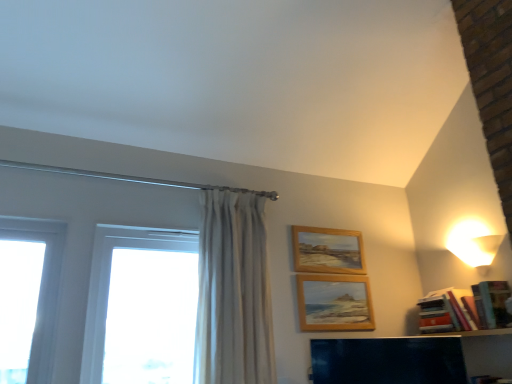
What is the approximate height of wooden picture frame at center, which ranks as the 1th picture frame in bottom-to-top order?

wooden picture frame at center, which ranks as the 1th picture frame in bottom-to-top order, is 12.62 inches tall.

What do you see at coordinates (327, 250) in the screenshot?
I see `wooden picture frame at upper center, the 2th picture frame in the bottom-to-top sequence` at bounding box center [327, 250].

I want to click on wooden shelf at lower right, so click(412, 358).

Find the location of a particular element. The image size is (512, 384). white glossy lampshade at upper right is located at coordinates (474, 244).

Where is `wooden picture frame at center, which ranks as the 1th picture frame in bottom-to-top order`? The height and width of the screenshot is (384, 512). wooden picture frame at center, which ranks as the 1th picture frame in bottom-to-top order is located at coordinates (334, 303).

From the picture: From a real-world perspective, does wooden picture frame at center, which appears as the 2th picture frame when viewed from the top, stand above wooden picture frame at upper center, the 1th picture frame from the top?

No, from a real-world perspective, wooden picture frame at center, which appears as the 2th picture frame when viewed from the top, is not above wooden picture frame at upper center, the 1th picture frame from the top.

From the image's perspective, is wooden picture frame at center, which ranks as the 1th picture frame in bottom-to-top order, located above or below wooden picture frame at upper center, the 2th picture frame in the bottom-to-top sequence?

Based on their image positions, wooden picture frame at center, which ranks as the 1th picture frame in bottom-to-top order, is located beneath wooden picture frame at upper center, the 2th picture frame in the bottom-to-top sequence.

Is wooden picture frame at center, which appears as the 2th picture frame when viewed from the top, bigger or smaller than wooden picture frame at upper center, the 2th picture frame in the bottom-to-top sequence?

Considering their sizes, wooden picture frame at center, which appears as the 2th picture frame when viewed from the top, takes up less space than wooden picture frame at upper center, the 2th picture frame in the bottom-to-top sequence.

Are hardcover books at right and white glossy lampshade at upper right making contact?

hardcover books at right is not next to white glossy lampshade at upper right, and they're not touching.

Could white glossy lampshade at upper right be considered to be inside hardcover books at right?

Actually, white glossy lampshade at upper right is outside hardcover books at right.

Considering the relative positions of hardcover books at right and white glossy lampshade at upper right in the image provided, is hardcover books at right in front of white glossy lampshade at upper right?

That is True.

Which object is wider, hardcover books at right or white glossy lampshade at upper right?

With larger width is hardcover books at right.

Can you tell me how much white glossy lampshade at upper right and wooden shelf at lower right differ in facing direction?

white glossy lampshade at upper right and wooden shelf at lower right are facing 48.1 degrees away from each other.

Is white glossy lampshade at upper right not close to wooden shelf at lower right?

No, white glossy lampshade at upper right is not far away from wooden shelf at lower right.

Is white glossy lampshade at upper right spatially inside wooden shelf at lower right, or outside of it?

white glossy lampshade at upper right cannot be found inside wooden shelf at lower right.

Is there a large distance between hardcover books at right and wooden picture frame at upper center, the 1th picture frame from the top?

That's not correct — hardcover books at right is a little close to wooden picture frame at upper center, the 1th picture frame from the top.

Does hardcover books at right appear on the right side of wooden picture frame at upper center, the 1th picture frame from the top?

Yes.

Which is correct: hardcover books at right is inside wooden picture frame at upper center, the 2th picture frame in the bottom-to-top sequence, or outside of it?

hardcover books at right is located beyond the bounds of wooden picture frame at upper center, the 2th picture frame in the bottom-to-top sequence.

Considering the positions of objects wooden shelf at lower right and wooden picture frame at upper center, the 2th picture frame in the bottom-to-top sequence, in the image provided, who is behind, wooden shelf at lower right or wooden picture frame at upper center, the 2th picture frame in the bottom-to-top sequence,?

Positioned behind is wooden picture frame at upper center, the 2th picture frame in the bottom-to-top sequence.

Considering the sizes of objects wooden shelf at lower right and wooden picture frame at upper center, the 1th picture frame from the top, in the image provided, who is shorter, wooden shelf at lower right or wooden picture frame at upper center, the 1th picture frame from the top,?

wooden picture frame at upper center, the 1th picture frame from the top.

Can you tell me how much wooden shelf at lower right and wooden picture frame at upper center, the 1th picture frame from the top, differ in facing direction?

There is a 41.9-degree angle between the facing directions of wooden shelf at lower right and wooden picture frame at upper center, the 1th picture frame from the top.

Is wooden picture frame at upper center, the 1th picture frame from the top, with white glossy lampshade at upper right?

No, wooden picture frame at upper center, the 1th picture frame from the top, is not beside white glossy lampshade at upper right.

Would you say wooden picture frame at upper center, the 1th picture frame from the top, contains white glossy lampshade at upper right?

That's incorrect, white glossy lampshade at upper right is not inside wooden picture frame at upper center, the 1th picture frame from the top.

Which of these two, wooden picture frame at upper center, the 2th picture frame in the bottom-to-top sequence, or white glossy lampshade at upper right, stands shorter?

white glossy lampshade at upper right is shorter.

Between wooden picture frame at upper center, the 2th picture frame in the bottom-to-top sequence, and white glossy lampshade at upper right, which one has larger width?

white glossy lampshade at upper right.

Considering the sizes of objects wooden shelf at lower right and white glass window at left in the image provided, who is shorter, wooden shelf at lower right or white glass window at left?

Standing shorter between the two is wooden shelf at lower right.

How much distance is there between wooden shelf at lower right and white glass window at left?

They are 4.13 feet apart.

Consider the image. Considering the positions of objects wooden shelf at lower right and white glass window at left in the image provided, who is more to the right, wooden shelf at lower right or white glass window at left?

wooden shelf at lower right is more to the right.

Is wooden shelf at lower right surrounding white glass window at left?

No.

Where is `picture frame behind the wooden picture frame at center, which ranks as the 1th picture frame in bottom-to-top order`? The width and height of the screenshot is (512, 384). picture frame behind the wooden picture frame at center, which ranks as the 1th picture frame in bottom-to-top order is located at coordinates (327, 250).

Image resolution: width=512 pixels, height=384 pixels. I want to click on lamp on the right of hardcover books at right, so click(x=474, y=244).

Considering their positions, is white glossy lampshade at upper right positioned further to hardcover books at right than white glass window at left?

white glass window at left is further to hardcover books at right.

Considering their positions, is wooden picture frame at upper center, the 1th picture frame from the top, positioned closer to white glass window at left than white glossy lampshade at upper right?

wooden picture frame at upper center, the 1th picture frame from the top, is positioned closer to the anchor white glass window at left.

Estimate the real-world distances between objects in this image. Which object is further from hardcover books at right, wooden picture frame at center, which ranks as the 1th picture frame in bottom-to-top order, or wooden shelf at lower right?

Among the two, wooden picture frame at center, which ranks as the 1th picture frame in bottom-to-top order, is located further to hardcover books at right.

Looking at the image, which one is located closer to hardcover books at right, white glass window at left or wooden picture frame at upper center, the 2th picture frame in the bottom-to-top sequence?

wooden picture frame at upper center, the 2th picture frame in the bottom-to-top sequence, is closer to hardcover books at right.

Looking at the image, which one is located further to hardcover books at right, wooden picture frame at center, which ranks as the 1th picture frame in bottom-to-top order, or white glossy lampshade at upper right?

wooden picture frame at center, which ranks as the 1th picture frame in bottom-to-top order.

Estimate the real-world distances between objects in this image. Which object is further from hardcover books at right, wooden picture frame at center, which appears as the 2th picture frame when viewed from the top, or white glass window at left?

white glass window at left is further to hardcover books at right.

When comparing their distances from white glossy lampshade at upper right, does white glass window at left or hardcover books at right seem closer?

Based on the image, hardcover books at right appears to be nearer to white glossy lampshade at upper right.

Which object lies further to the anchor point white glossy lampshade at upper right, white glass window at left or wooden shelf at lower right?

white glass window at left is positioned further to the anchor white glossy lampshade at upper right.

Locate an element on the screen. book situated between white glass window at left and white glossy lampshade at upper right from left to right is located at coordinates (462, 308).

This screenshot has width=512, height=384. Find the location of `book between wooden shelf at lower right and white glossy lampshade at upper right in the horizontal direction`. book between wooden shelf at lower right and white glossy lampshade at upper right in the horizontal direction is located at coordinates (462, 308).

Where is `shelf between wooden picture frame at center, which ranks as the 1th picture frame in bottom-to-top order, and hardcover books at right`? The width and height of the screenshot is (512, 384). shelf between wooden picture frame at center, which ranks as the 1th picture frame in bottom-to-top order, and hardcover books at right is located at coordinates (412, 358).

Locate an element on the screen. This screenshot has height=384, width=512. picture frame situated between wooden picture frame at upper center, the 2th picture frame in the bottom-to-top sequence, and hardcover books at right from left to right is located at coordinates (334, 303).